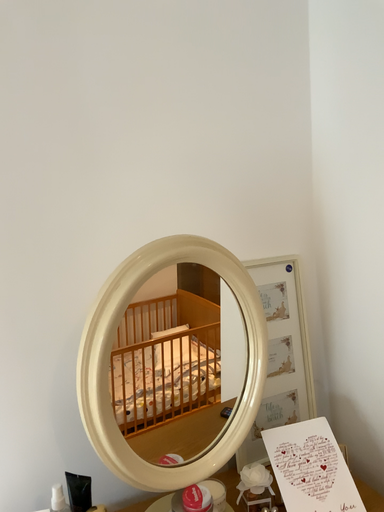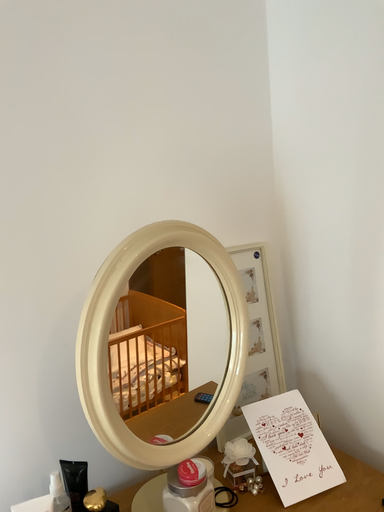
Question: How did the camera likely rotate when shooting the video?

Choices:
 (A) rotated right
 (B) rotated left

Answer: (A)